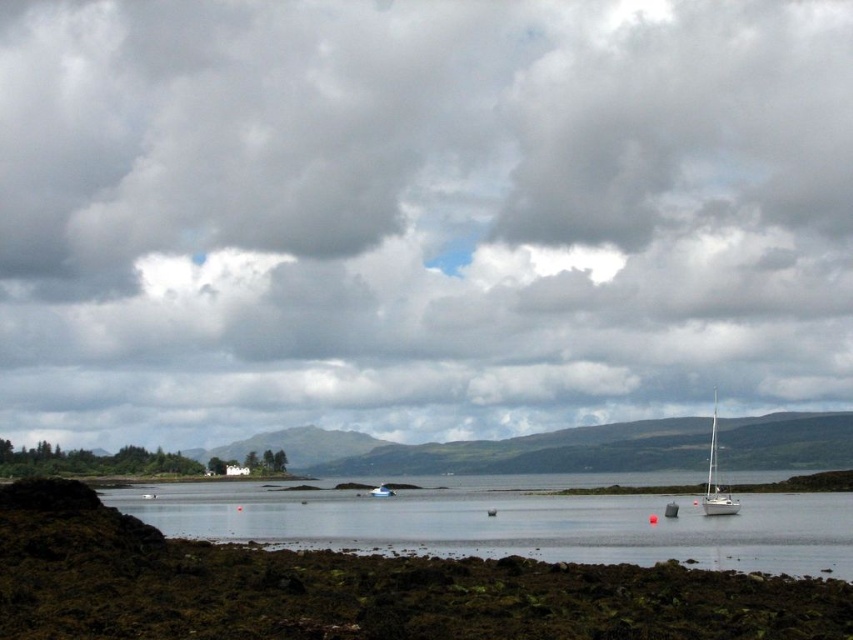
You are a photographer planning to capture the white glossy sailboat at lower right and the clear water at center in the same frame. Based on their positions, which object should you focus on first to ensure both are in the shot?

The clear water at center is positioned on the left side of white glossy sailboat at lower right, so focusing on the sailboat first would naturally include the clear water in the frame as it is positioned to the left of the sailboat.

You are an artist planning to paint the coastal scene. You want to ensure that the cloudy sky at upper center and the white plastic boat at center are proportionally accurate. Which object should you paint first to maintain the correct size relationship between them?

The cloudy sky at upper center should be painted first since it is larger in size than the white plastic boat at center, ensuring the boat is proportionally smaller in relation to the sky.

You are an observer standing on the rocky shoreline in the coastal scene. You see the clear water at center and the white plastic boat at center. Which object appears taller from your viewpoint?

The clear water at center appears taller than the white plastic boat at center from the observer viewpoint.